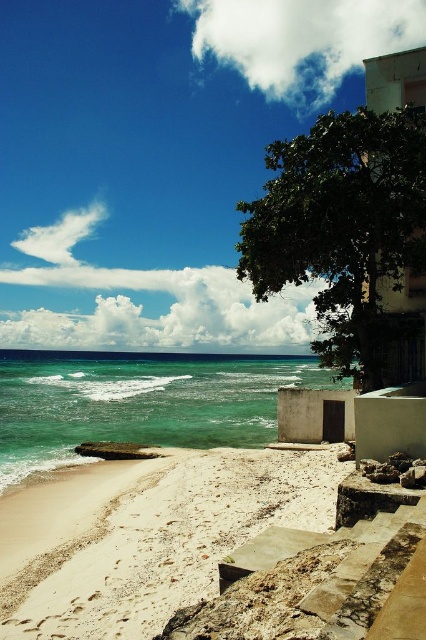
Question: Which object appears farthest from the camera in this image?

Choices:
 (A) clear turquoise water at center
 (B) green leafy tree at upper right
 (C) white sandy beach at lower left

Answer: (A)

Question: Which object is the farthest from the white sandy beach at lower left?

Choices:
 (A) clear turquoise water at center
 (B) green leafy tree at upper right

Answer: (A)

Question: Where is white sandy beach at lower left located in relation to clear turquoise water at center in the image?

Choices:
 (A) left
 (B) right

Answer: (B)

Question: Can you confirm if white sandy beach at lower left is wider than clear turquoise water at center?

Choices:
 (A) yes
 (B) no

Answer: (B)

Question: Is green leafy tree at upper right further to the viewer compared to clear turquoise water at center?

Choices:
 (A) no
 (B) yes

Answer: (A)

Question: Which point is farther to the camera?

Choices:
 (A) clear turquoise water at center
 (B) green leafy tree at upper right

Answer: (A)